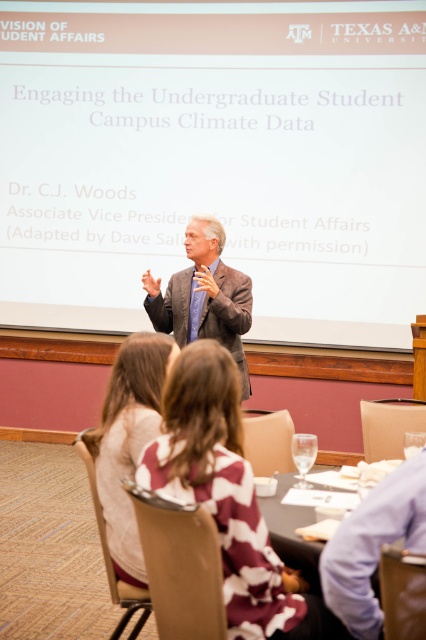
Question: From the image, what is the correct spatial relationship of camouflage fabric jacket at lower center in relation to light brown suit at center?

Choices:
 (A) below
 (B) above

Answer: (A)

Question: Does maroon and white patterned sweater at center come behind camouflage fabric jacket at lower center?

Choices:
 (A) yes
 (B) no

Answer: (B)

Question: Which object is the closest to the camouflage fabric jacket at lower center?

Choices:
 (A) light brown suit at center
 (B) translucent glass table at center

Answer: (B)

Question: Considering the real-world distances, which object is closest to the maroon and white patterned sweater at center?

Choices:
 (A) light brown suit at center
 (B) camouflage fabric jacket at lower center

Answer: (B)

Question: Is camouflage fabric jacket at lower center to the left of light brown suit at center from the viewer's perspective?

Choices:
 (A) yes
 (B) no

Answer: (A)

Question: Which point is closer to the camera?

Choices:
 (A) translucent glass table at center
 (B) maroon and white patterned sweater at center
 (C) camouflage fabric jacket at lower center
 (D) light brown suit at center

Answer: (B)